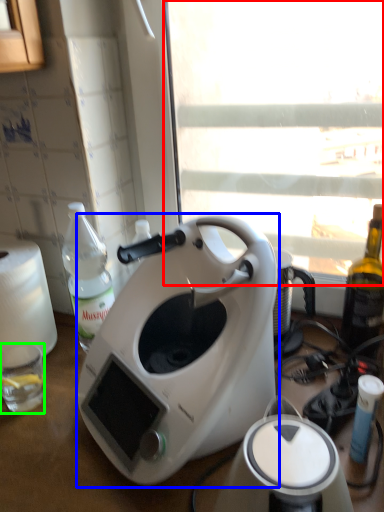
Question: Which object is positioned closest to window screen (highlighted by a red box)? Select from coffee maker (highlighted by a blue box) and coffee cup (highlighted by a green box).

Choices:
 (A) coffee maker
 (B) coffee cup

Answer: (A)